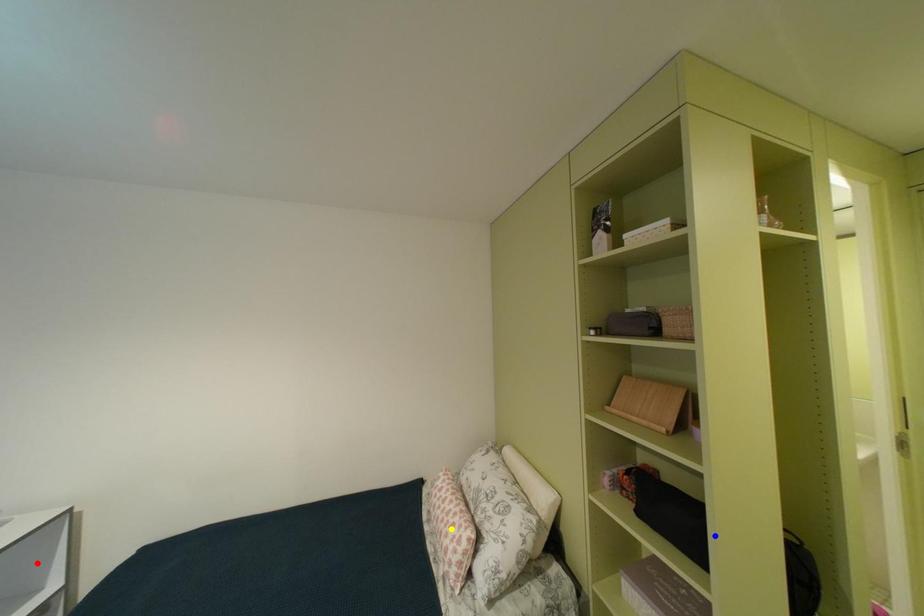
Order these from nearest to farthest:
A) blue point
B) red point
C) yellow point

yellow point < blue point < red point